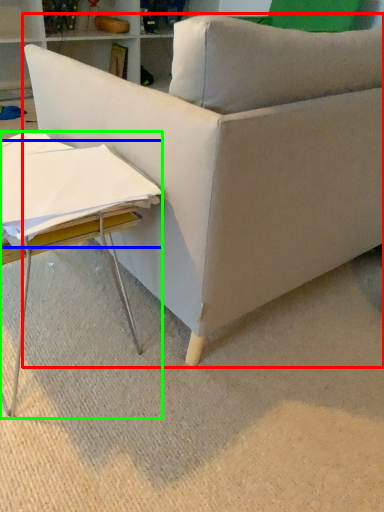
Question: Which object is the farthest from studio couch (highlighted by a red box)? Choose among these: sheet (highlighted by a blue box) or table (highlighted by a green box).

Choices:
 (A) sheet
 (B) table

Answer: (A)